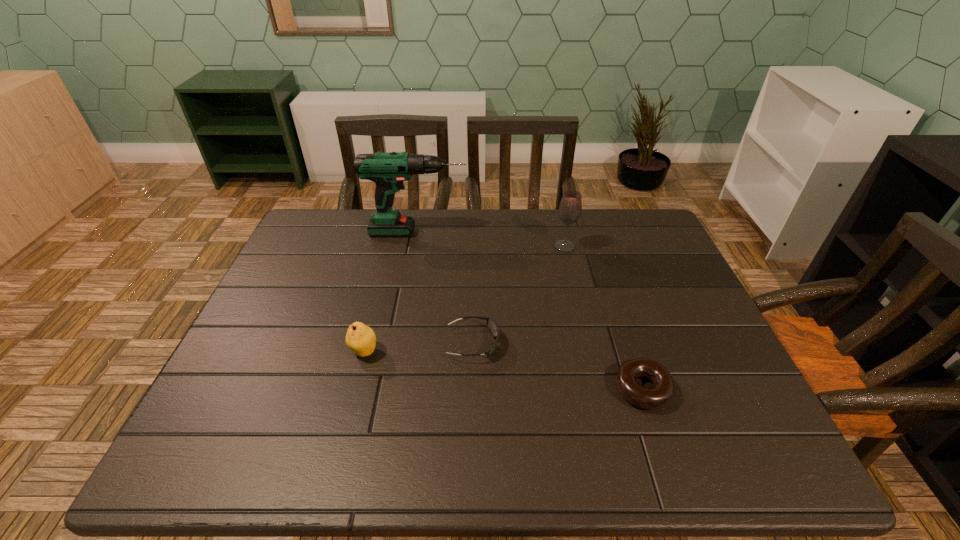
You are a GUI agent. You are given a task and a screenshot of the screen. Output one action in this format:
    pyautogui.click(x=<x>, y=<y>)
    Task: Click on the farthest object
    
    Given the screenshot: What is the action you would take?
    pyautogui.click(x=388, y=170)

The image size is (960, 540). In order to click on drill in this screenshot , I will do `click(388, 170)`.

You are a GUI agent. You are given a task and a screenshot of the screen. Output one action in this format:
    pyautogui.click(x=<x>, y=<y>)
    Task: Click on the second farthest object
    The height and width of the screenshot is (540, 960).
    Given the screenshot: What is the action you would take?
    pyautogui.click(x=570, y=208)

The image size is (960, 540). Find the location of `glass drink container`. glass drink container is located at coordinates (570, 208).

The image size is (960, 540). Find the location of `pear`. pear is located at coordinates (361, 339).

Image resolution: width=960 pixels, height=540 pixels. Identify the location of the nearest object. (655, 397).

Identify the location of the rightmost object. (655, 397).

The width and height of the screenshot is (960, 540). I want to click on goggles, so click(491, 324).

Identify the location of vacant space located on the handle side of the farthest object. (564, 232).

Locate an element on the screen. This screenshot has width=960, height=540. free space located on the back of the fourth object from left to right is located at coordinates (559, 224).